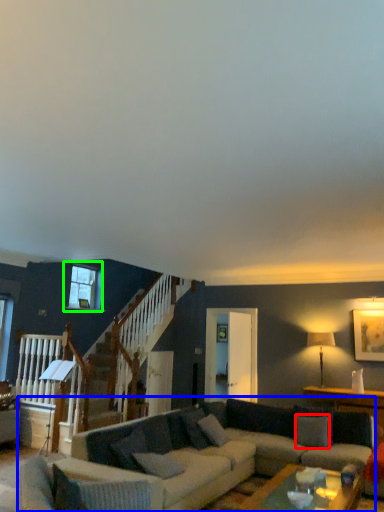
Question: Based on their relative distances, which object is nearer to pillow (highlighted by a red box)? Choose from studio couch (highlighted by a blue box) and window (highlighted by a green box).

Choices:
 (A) studio couch
 (B) window

Answer: (A)